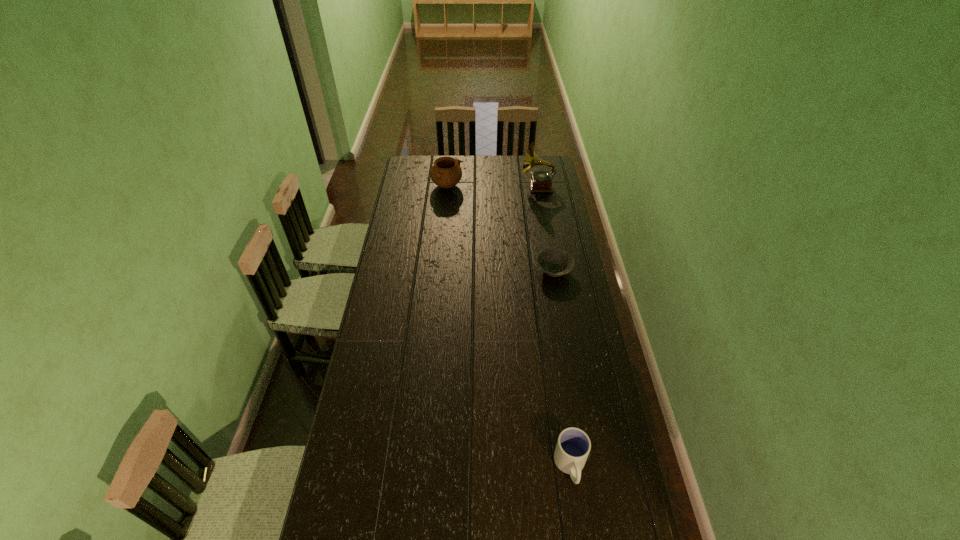
I want to click on vacant space located on the right of the leftmost object, so click(476, 186).

Locate an element on the screen. The height and width of the screenshot is (540, 960). free spot located 0.060m with the handle on the side of the nearest object is located at coordinates (577, 511).

The width and height of the screenshot is (960, 540). Identify the location of vacant space situated on the left of the bowl. (457, 271).

Locate an element on the screen. This screenshot has width=960, height=540. phonograph_record located in the right edge section of the desktop is located at coordinates (541, 181).

Locate an element on the screen. This screenshot has width=960, height=540. cup located in the right edge section of the desktop is located at coordinates (573, 446).

You are a GUI agent. You are given a task and a screenshot of the screen. Output one action in this format:
    pyautogui.click(x=<x>, y=<y>)
    Task: Click on the bowl that is at the right edge
    This screenshot has height=540, width=960.
    Given the screenshot: What is the action you would take?
    pyautogui.click(x=555, y=262)

Find the location of `free point at the far edge`. free point at the far edge is located at coordinates (505, 165).

Find the location of a particular element. The width and height of the screenshot is (960, 540). vacant region at the left edge of the desktop is located at coordinates (355, 387).

Find the location of a particular element. This screenshot has width=960, height=540. vacant area at the right edge is located at coordinates (551, 289).

This screenshot has width=960, height=540. Identify the location of vacant area at the far right corner. (549, 169).